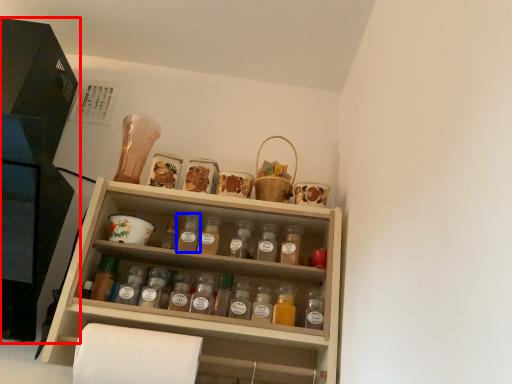
Question: Which of the following is the closest to the observer, cabinetry (highlighted by a red box) or bottle (highlighted by a blue box)?

Choices:
 (A) cabinetry
 (B) bottle

Answer: (A)